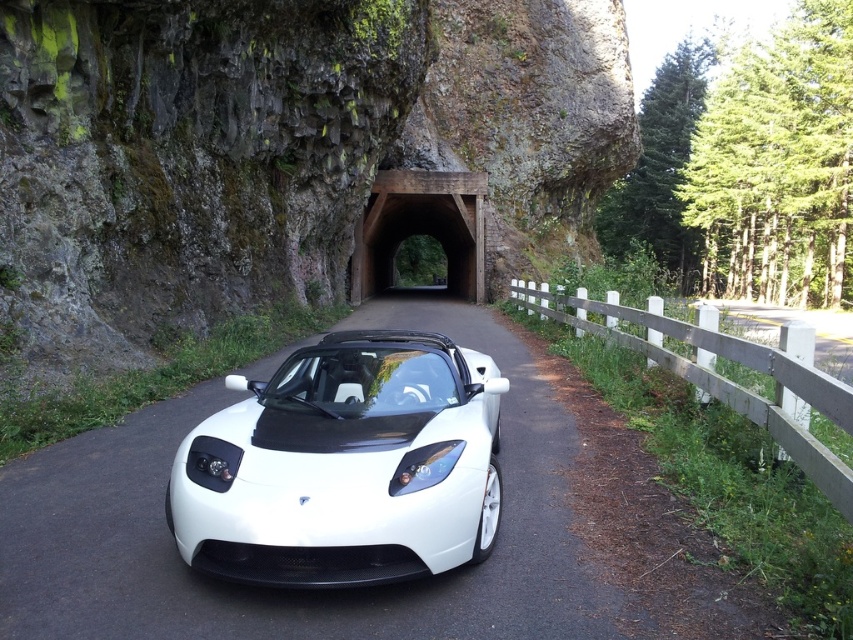
Question: Which of the following is the closest to the observer?

Choices:
 (A) (178, 420)
 (B) (466, 212)

Answer: (A)

Question: Can you confirm if white matte car at center is bigger than brown wooden tunnel at center?

Choices:
 (A) no
 (B) yes

Answer: (A)

Question: Is white matte car at center to the right of brown wooden tunnel at center from the viewer's perspective?

Choices:
 (A) no
 (B) yes

Answer: (B)

Question: Based on their relative distances, which object is farther from the white matte sports car at center?

Choices:
 (A) brown wooden tunnel at center
 (B) white matte car at center

Answer: (A)

Question: Is white matte sports car at center further to camera compared to brown wooden tunnel at center?

Choices:
 (A) no
 (B) yes

Answer: (A)

Question: Considering the real-world distances, which object is farthest from the white matte car at center?

Choices:
 (A) white matte sports car at center
 (B) brown wooden tunnel at center

Answer: (B)